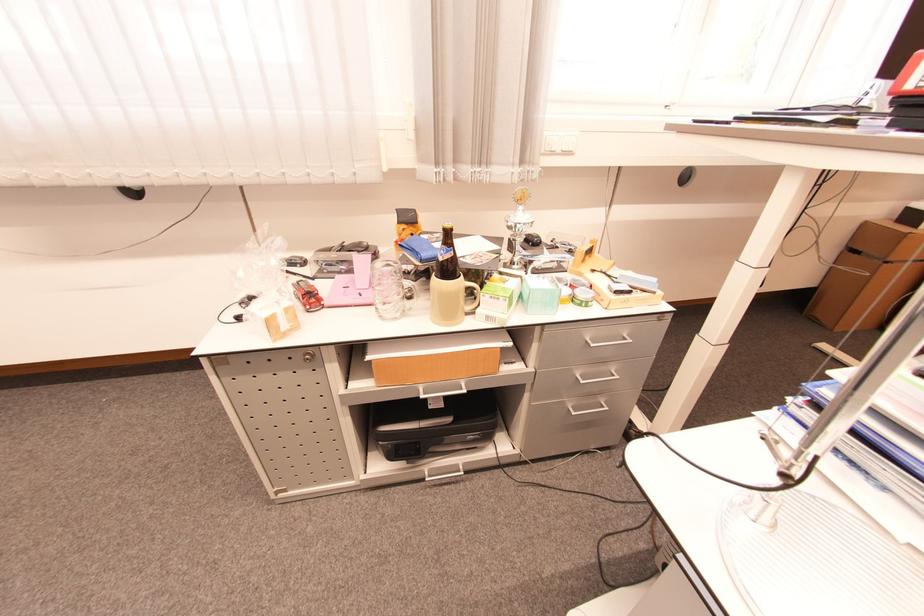
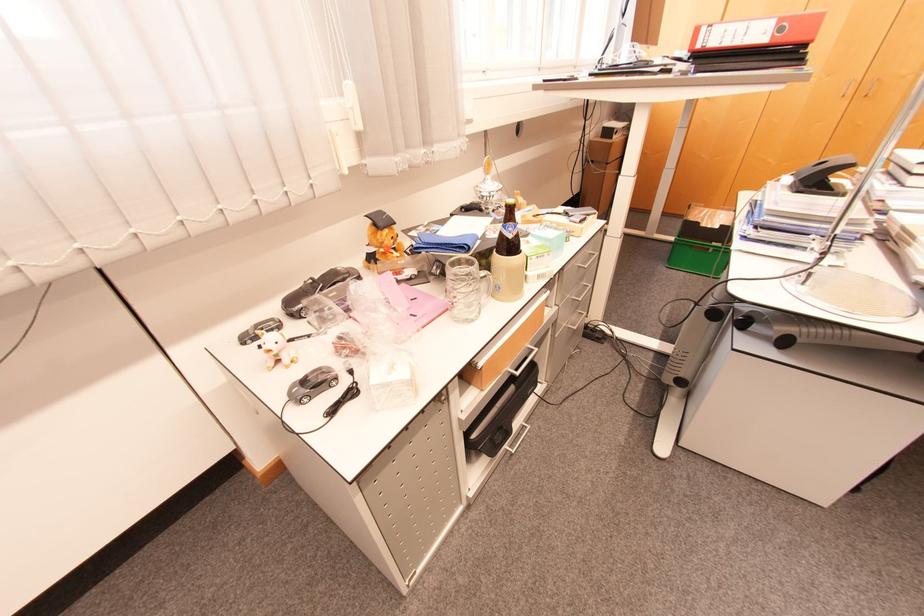
Question: The camera is either moving clockwise (left) or counter-clockwise (right) around the object. The first image is from the beginning of the video and the second image is from the end. Is the camera moving left or right when shooting the video?

Choices:
 (A) Left
 (B) Right

Answer: (A)